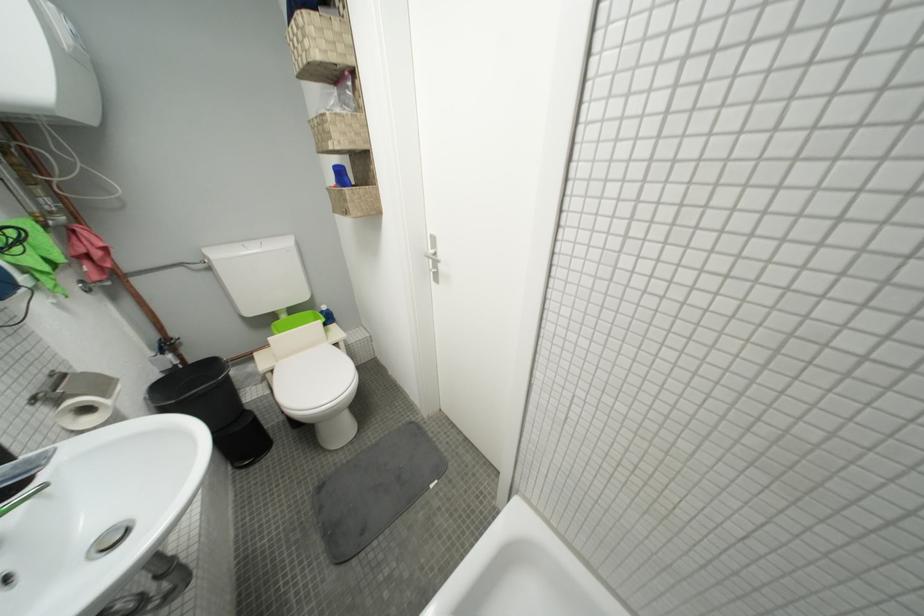
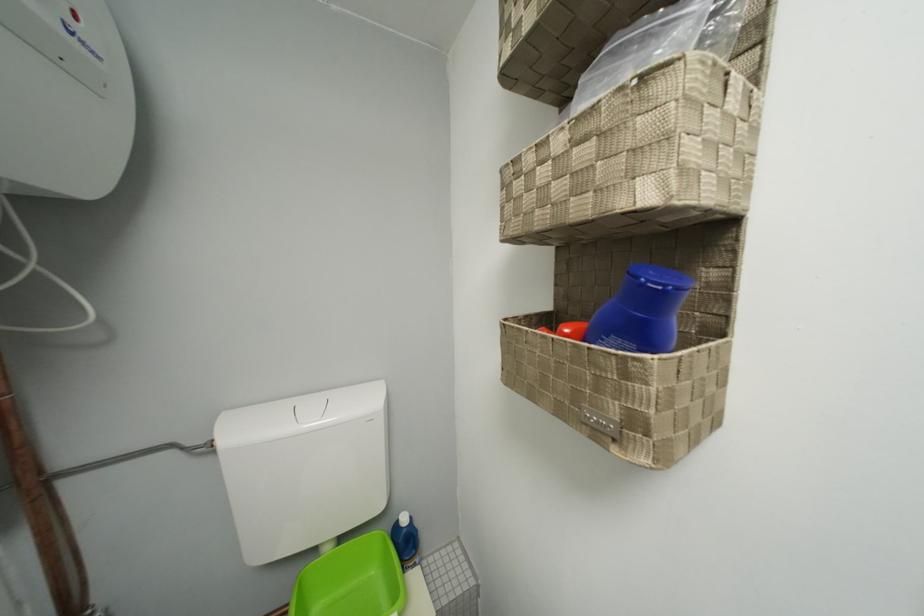
The images are taken continuously from a first-person perspective. In which direction are you moving?

The cameraman walked toward left, forward.